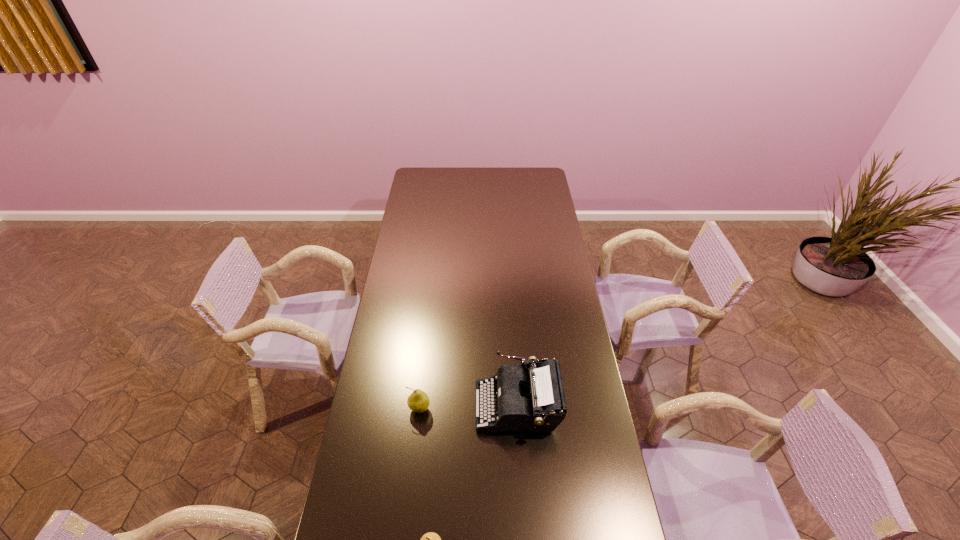
Identify the location of free region at the far edge of the desktop. This screenshot has height=540, width=960. (469, 187).

In the image, there is a desktop. Identify the location of vacant space at the left edge. (418, 319).

The height and width of the screenshot is (540, 960). Identify the location of free space at the right edge of the desktop. (592, 491).

Where is `unoccupied area between the rightmost object and the leftmost object`? The image size is (960, 540). unoccupied area between the rightmost object and the leftmost object is located at coordinates (468, 407).

The image size is (960, 540). What are the coordinates of `vacant space in between the tallest object and the left pear` in the screenshot? It's located at (468, 407).

This screenshot has width=960, height=540. I want to click on the closest object to the rightmost object, so click(418, 401).

What are the coordinates of `object that ranks as the second closest to the second object from right to left` in the screenshot? It's located at (418, 401).

At what (x,y) coordinates should I click in order to perform the action: click on vacant space that satisfies the following two spatial constraints: 1. on the typing side of the rightmost object; 2. on the front side of the taller pear. Please return your answer as a coordinate pair (x, y). The width and height of the screenshot is (960, 540). Looking at the image, I should click on (517, 409).